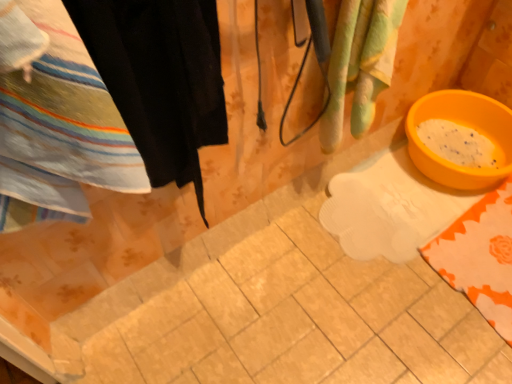
Question: Would you say orange plastic basin at lower right is to the left or to the right of green striped towel at upper right in the picture?

Choices:
 (A) right
 (B) left

Answer: (A)

Question: Is orange plastic basin at lower right inside the boundaries of green striped towel at upper right, or outside?

Choices:
 (A) outside
 (B) inside

Answer: (A)

Question: Which object is the closest to the green striped towel at upper right?

Choices:
 (A) striped cotton towel at left
 (B) black fabric at left
 (C) orange plastic basin at lower right

Answer: (B)

Question: Estimate the real-world distances between objects in this image. Which object is farther from the striped cotton towel at left?

Choices:
 (A) black fabric at left
 (B) green striped towel at upper right
 (C) orange plastic basin at lower right

Answer: (C)